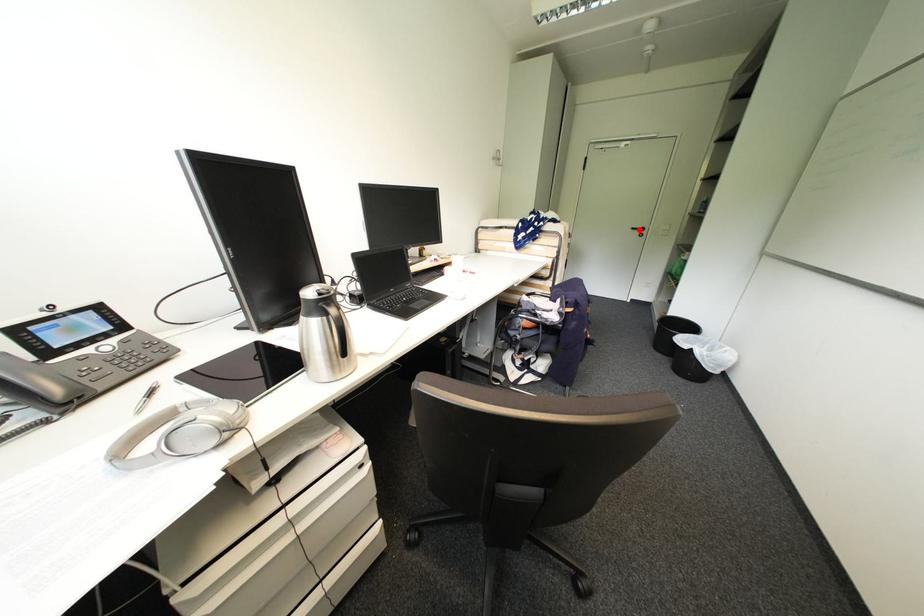
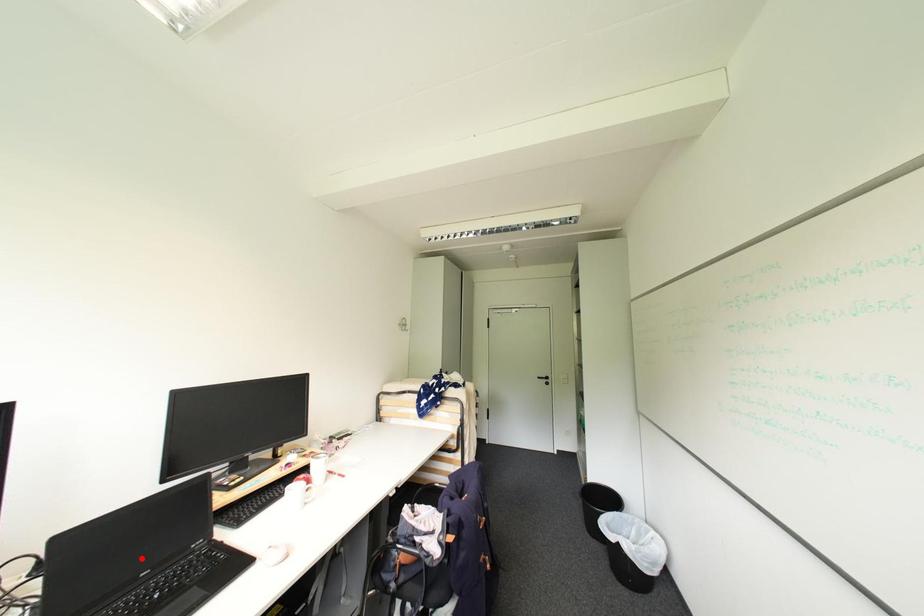
I am providing you with two images of the same scene from different viewpoints. A red point is marked on the first image and another point is marked on the second image. Are the points marked in image1 and image2 representing the same 3D position?

No